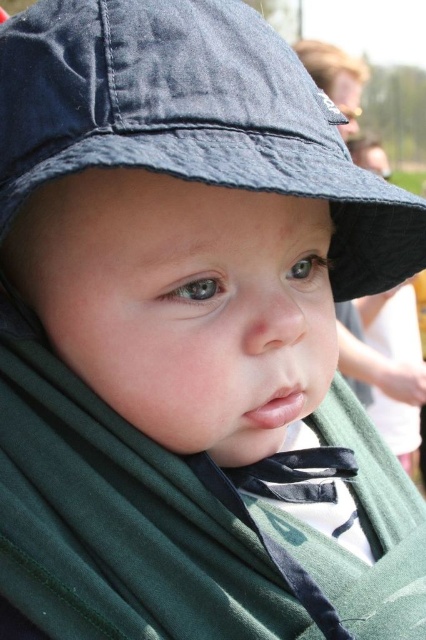
Question: Is green soft fabric shawl at center positioned before dark blue fabric hat at upper center?

Choices:
 (A) yes
 (B) no

Answer: (B)

Question: Is green soft fabric shawl at center positioned in front of dark blue fabric hat at upper center?

Choices:
 (A) yes
 (B) no

Answer: (B)

Question: Among these points, which one is nearest to the camera?

Choices:
 (A) (x=170, y=108)
 (B) (x=367, y=627)

Answer: (A)

Question: Does green soft fabric shawl at center have a larger size compared to dark blue fabric hat at upper center?

Choices:
 (A) yes
 (B) no

Answer: (B)

Question: Among these objects, which one is nearest to the camera?

Choices:
 (A) green soft fabric shawl at center
 (B) dark blue fabric hat at upper center

Answer: (B)